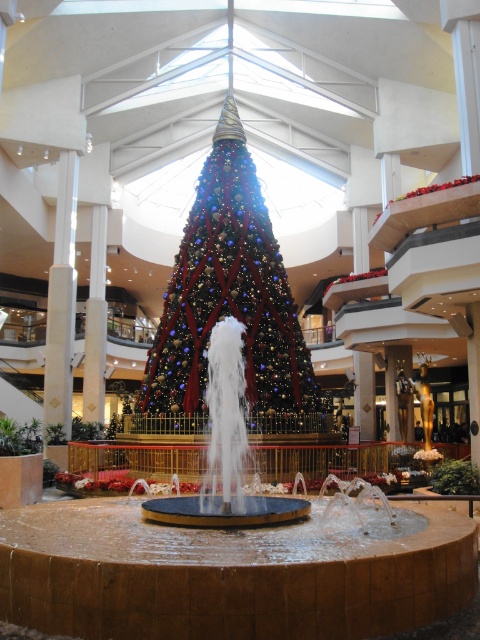
Question: Which object is closer to the camera taking this photo?

Choices:
 (A) multicolored glittering tree at center
 (B) shiny metallic fountain at center

Answer: (B)

Question: Can you confirm if multicolored glittering tree at center is thinner than shiny metallic fountain at center?

Choices:
 (A) no
 (B) yes

Answer: (A)

Question: Among these objects, which one is farthest from the camera?

Choices:
 (A) shiny metallic fountain at center
 (B) multicolored glittering tree at center

Answer: (B)

Question: Which point is farther from the camera taking this photo?

Choices:
 (A) (199, 324)
 (B) (218, 337)

Answer: (A)

Question: Is multicolored glittering tree at center thinner than shiny metallic fountain at center?

Choices:
 (A) yes
 (B) no

Answer: (B)

Question: Is multicolored glittering tree at center thinner than shiny metallic fountain at center?

Choices:
 (A) yes
 (B) no

Answer: (B)